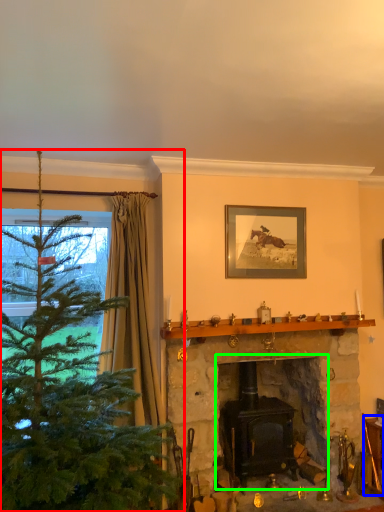
Question: Considering the real-world distances, which object is farthest from christmas tree (highlighted by a red box)? furniture (highlighted by a blue box) or fireplace (highlighted by a green box)?

Choices:
 (A) furniture
 (B) fireplace

Answer: (A)